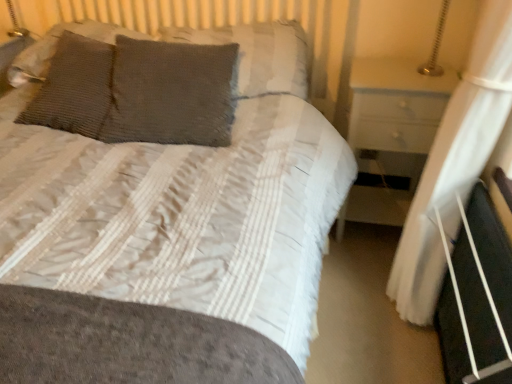
Question: Should I look upward or downward to see textured gray pillow at upper left, positioned as the second pillow in left-to-right order?

Choices:
 (A) up
 (B) down

Answer: (A)

Question: From a real-world perspective, is black plastic bed frame at lower right physically below gray textured pillow at center, positioned as the fourth pillow in left-to-right order?

Choices:
 (A) no
 (B) yes

Answer: (B)

Question: Is gray textured pillow at center, positioned as the 1th pillow in right-to-left order, at the back of black plastic bed frame at lower right?

Choices:
 (A) yes
 (B) no

Answer: (B)

Question: Is black plastic bed frame at lower right taller than gray textured pillow at center, positioned as the 1th pillow in right-to-left order?

Choices:
 (A) no
 (B) yes

Answer: (B)

Question: Considering the relative sizes of black plastic bed frame at lower right and gray textured pillow at center, positioned as the fourth pillow in left-to-right order, in the image provided, is black plastic bed frame at lower right wider than gray textured pillow at center, positioned as the fourth pillow in left-to-right order,?

Choices:
 (A) no
 (B) yes

Answer: (A)

Question: Can you confirm if black plastic bed frame at lower right is shorter than gray textured pillow at center, positioned as the fourth pillow in left-to-right order?

Choices:
 (A) no
 (B) yes

Answer: (A)

Question: From the image's perspective, would you say black plastic bed frame at lower right is shown under gray textured pillow at center, positioned as the fourth pillow in left-to-right order?

Choices:
 (A) no
 (B) yes

Answer: (B)

Question: Does gray textured pillow at center, positioned as the fourth pillow in left-to-right order, appear on the left side of textured gray pillow at upper left, the third pillow when ordered from right to left?

Choices:
 (A) no
 (B) yes

Answer: (A)

Question: Does gray textured pillow at center, positioned as the fourth pillow in left-to-right order, have a greater height compared to textured gray pillow at upper left, the third pillow when ordered from right to left?

Choices:
 (A) no
 (B) yes

Answer: (A)

Question: Is gray textured pillow at center, positioned as the 1th pillow in right-to-left order, further to the viewer compared to textured gray pillow at upper left, positioned as the second pillow in left-to-right order?

Choices:
 (A) no
 (B) yes

Answer: (B)

Question: From a real-world perspective, is gray textured pillow at center, positioned as the fourth pillow in left-to-right order, below textured gray pillow at upper left, the third pillow when ordered from right to left?

Choices:
 (A) no
 (B) yes

Answer: (A)

Question: Can you confirm if gray textured pillow at center, positioned as the 1th pillow in right-to-left order, is positioned to the right of textured gray pillow at upper left, positioned as the second pillow in left-to-right order?

Choices:
 (A) yes
 (B) no

Answer: (A)

Question: From the image's perspective, is gray textured pillow at center, positioned as the 1th pillow in right-to-left order, located beneath textured gray pillow at upper left, positioned as the second pillow in left-to-right order?

Choices:
 (A) yes
 (B) no

Answer: (B)

Question: Would you say white sheer curtain at right is outside gray knitted pillow at center, which is counted as the third pillow, starting from the left?

Choices:
 (A) yes
 (B) no

Answer: (A)